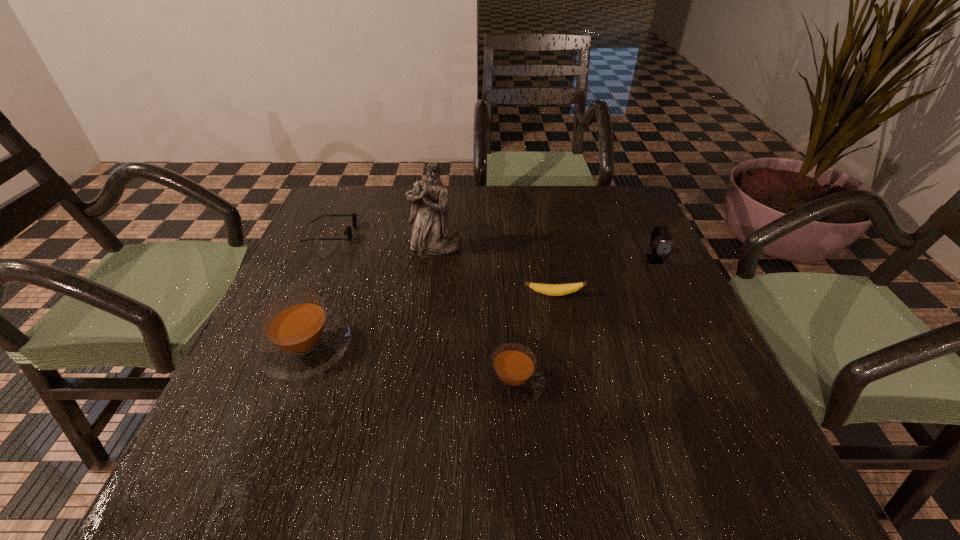
Locate an element on the screen. vacant space that satisfies the following two spatial constraints: 1. on the front-facing side of the third nearest object; 2. on the right side of the third object from left to right is located at coordinates (429, 294).